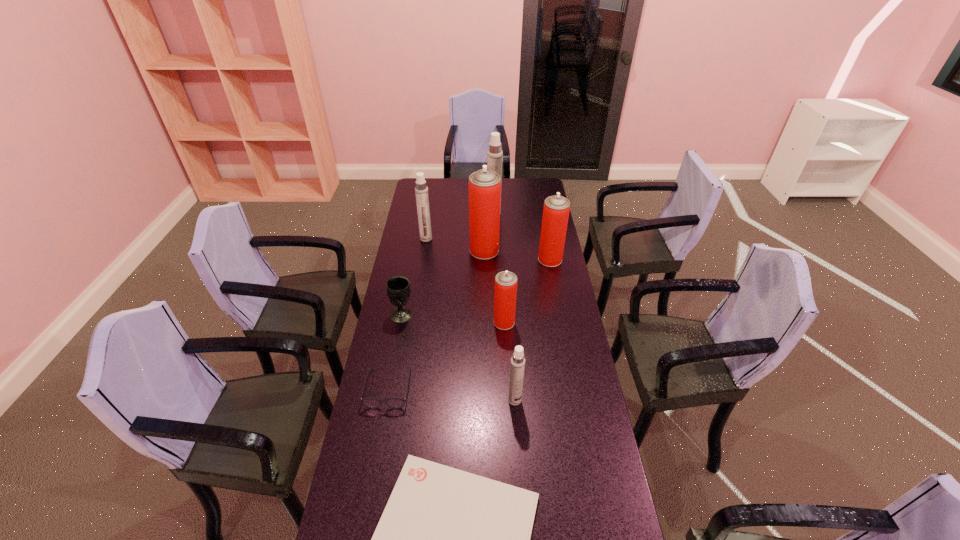
Locate an element on the screen. The height and width of the screenshot is (540, 960). the nearest white aerosol can is located at coordinates (517, 367).

You are a GUI agent. You are given a task and a screenshot of the screen. Output one action in this format:
    pyautogui.click(x=<x>, y=<y>)
    Task: Click on the chalice
    The width and height of the screenshot is (960, 540).
    Given the screenshot: What is the action you would take?
    pyautogui.click(x=398, y=287)

In order to click on the eighth tallest object in this screenshot , I will do `click(372, 403)`.

Image resolution: width=960 pixels, height=540 pixels. I want to click on vacant space located 0.280m on the front of the farthest aerosol can, so click(x=495, y=249).

Image resolution: width=960 pixels, height=540 pixels. Find the location of `vacant area located 0.110m on the front of the biggest red aerosol can`. vacant area located 0.110m on the front of the biggest red aerosol can is located at coordinates (485, 275).

The image size is (960, 540). Identify the location of free space located 0.370m on the front of the leftmost white aerosol can. (418, 293).

Image resolution: width=960 pixels, height=540 pixels. Identify the location of free spot located 0.050m on the left of the rightmost red aerosol can. (527, 259).

You are a GUI agent. You are given a task and a screenshot of the screen. Output one action in this format:
    pyautogui.click(x=<x>, y=<y>)
    Task: Click on the free spot located 0.150m on the left of the nearest red aerosol can
    The width and height of the screenshot is (960, 540).
    Given the screenshot: What is the action you would take?
    pyautogui.click(x=457, y=322)

Where is `free region located 0.350m on the left of the nearest aerosol can`? free region located 0.350m on the left of the nearest aerosol can is located at coordinates (406, 400).

Locate an element on the screen. free space located 0.330m on the right of the chalice is located at coordinates (493, 314).